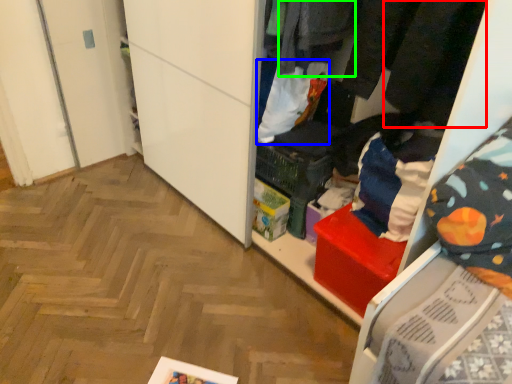
Question: Which is farther away from clothing (highlighted by a red box)? clothing (highlighted by a blue box) or clothing (highlighted by a green box)?

Choices:
 (A) clothing
 (B) clothing

Answer: (A)